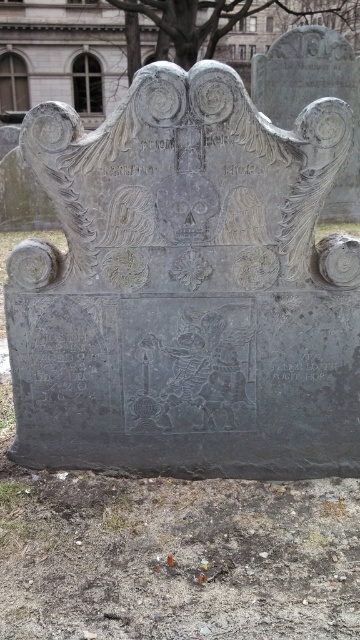
You are standing in a cemetery and see the gray stone gravestone at center and the black stone inscription at center. Which one is closer to you?

The gray stone gravestone at center is closer to you because it is in front of the black stone inscription at center.

From the picture: You are a historian examining the gray stone gravestone at center and the black stone inscription at center. Which object would you need to use a magnifying glass on to examine details more closely, considering their sizes?

The black stone inscription at center would require a magnifying glass because it is smaller than the gray stone gravestone at center, making its details harder to see without assistance.

Looking at this image, you are an archaeologist examining a historical site. You notice the gray stone gravestone at center and the black stone inscription at center. Which object has a greater width?

The gray stone gravestone at center has a greater width than the black stone inscription at center.